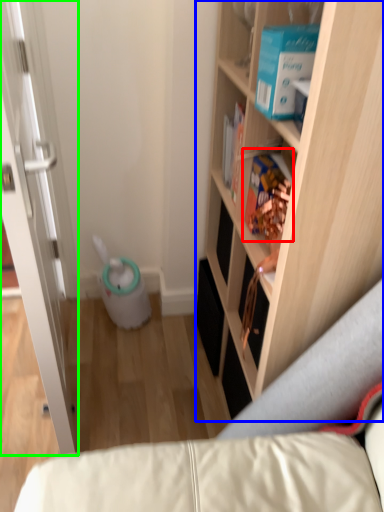
Question: Considering the real-world distances, which object is farthest from book (highlighted by a red box)? cabinetry (highlighted by a blue box) or door (highlighted by a green box)?

Choices:
 (A) cabinetry
 (B) door

Answer: (B)